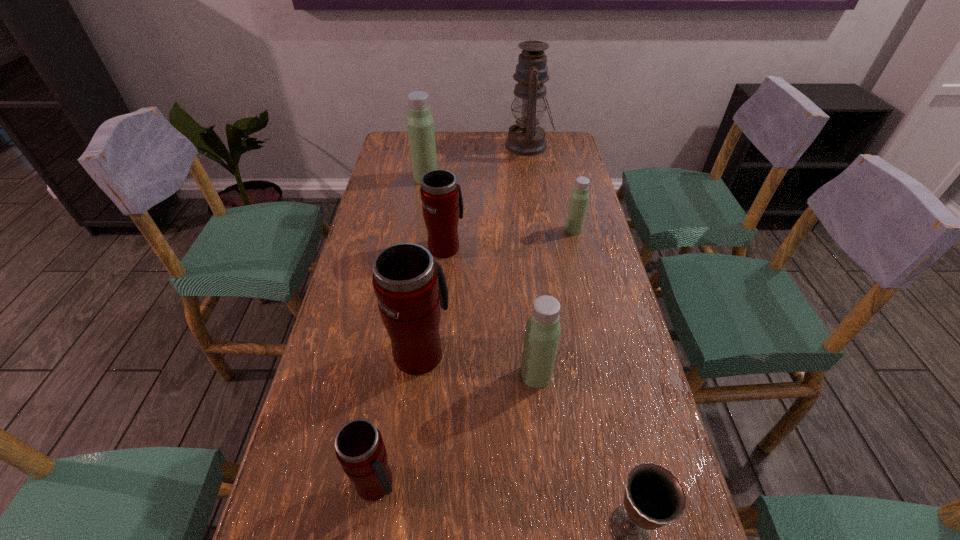
The width and height of the screenshot is (960, 540). I want to click on free point at the far right corner, so click(x=574, y=150).

Where is `free space between the farthest red thermos bottle and the brown oil lamp`? The height and width of the screenshot is (540, 960). free space between the farthest red thermos bottle and the brown oil lamp is located at coordinates (487, 196).

Where is `free space that is in between the second farthest red thermos bottle and the nearest thermos bottle`? The width and height of the screenshot is (960, 540). free space that is in between the second farthest red thermos bottle and the nearest thermos bottle is located at coordinates (398, 418).

Identify the location of empty space between the biggest red thermos bottle and the nearest light thermos bottle. (478, 363).

Locate an element on the screen. This screenshot has width=960, height=540. vacant area that lies between the nearest thermos bottle and the second nearest light thermos bottle is located at coordinates (475, 356).

I want to click on blank region between the second smallest red thermos bottle and the second light thermos bottle from left to right, so click(491, 311).

Identify the location of free point between the fifth thermos bottle from left to right and the second biggest red thermos bottle. This screenshot has width=960, height=540. (491, 311).

The image size is (960, 540). What are the coordinates of `free space between the second farthest red thermos bottle and the nearest red thermos bottle` in the screenshot? It's located at (398, 418).

You are a GUI agent. You are given a task and a screenshot of the screen. Output one action in this format:
    pyautogui.click(x=<x>, y=<y>)
    Task: Click on the object that is the closest one to the second farthest red thermos bottle
    Image resolution: width=960 pixels, height=540 pixels.
    Given the screenshot: What is the action you would take?
    pyautogui.click(x=542, y=333)

At what (x,y) coordinates should I click in order to perform the action: click on object that is the sixth closest to the rightmost thermos bottle. Please return your answer as a coordinate pair (x, y). The width and height of the screenshot is (960, 540). Looking at the image, I should click on (654, 497).